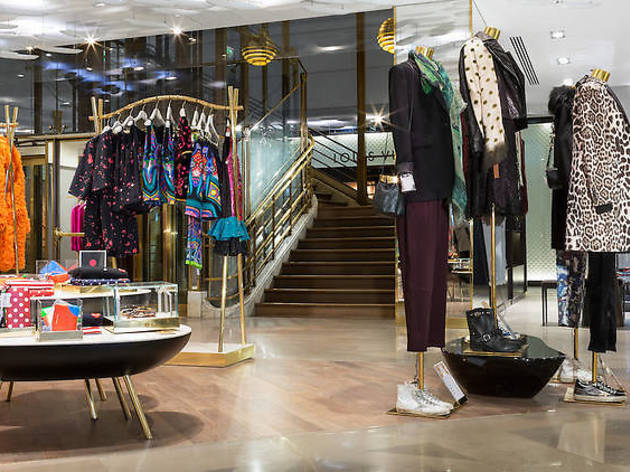
I want to click on hanger, so click(166, 96), click(9, 122).